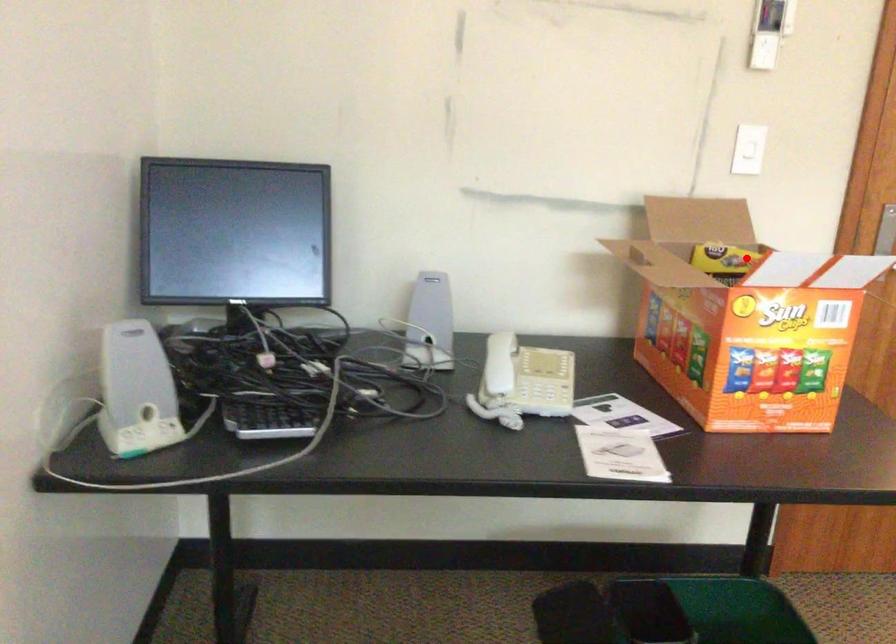
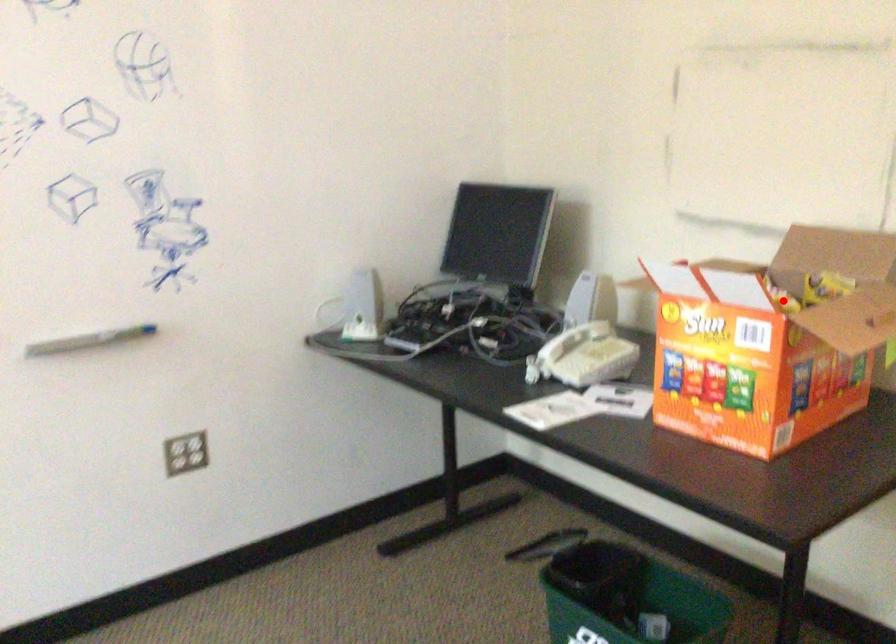
I am providing you with two images of the same scene from different viewpoints. A red point is marked on the first image and another point is marked on the second image. Do the highlighted points in image1 and image2 indicate the same real-world spot?

No